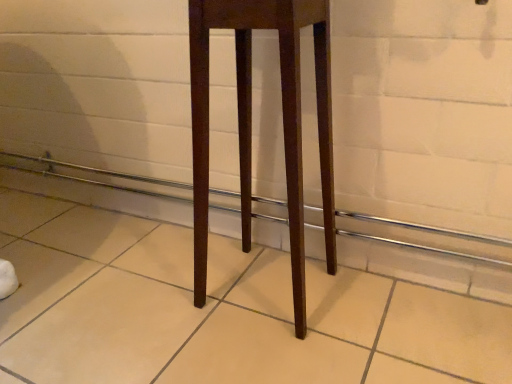
What are the coordinates of `free location to the right of mahogany wood stool at center` in the screenshot? It's located at (383, 323).